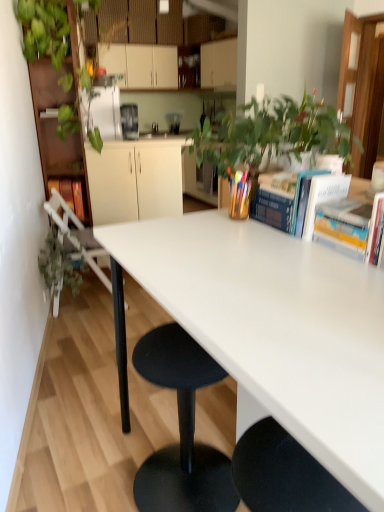
Question: Looking at the image, does metallic silver toaster at center, the first appliance positioned from the top, seem bigger or smaller compared to white glossy table at center?

Choices:
 (A) big
 (B) small

Answer: (B)

Question: From a real-world perspective, is metallic silver toaster at center, which appears as the second appliance when viewed from the front, physically located above or below white glossy table at center?

Choices:
 (A) below
 (B) above

Answer: (B)

Question: Estimate the real-world distances between objects in this image. Which object is closer to the matte white cabinets at upper center, the 1th cabinetry when ordered from back to front?

Choices:
 (A) green leafy plant at left
 (B) metallic silver toaster at center, the second appliance positioned from the left
 (C) green matte plant at center
 (D) white plastic chair at left
 (E) hardcover book at upper right, acting as the 2th book starting from the back

Answer: (B)

Question: Estimate the real-world distances between objects in this image. Which object is farther from the hardcover book at upper right, acting as the 2th book starting from the back?

Choices:
 (A) green leafy plant at upper left
 (B) hardcover book at upper right, the 4th book in the back-to-front sequence
 (C) matte white cabinets at upper center, the 2th cabinetry from the front
 (D) white glossy table at center
 (E) blue hardcover book at upper right, the 3th book from the right

Answer: (C)